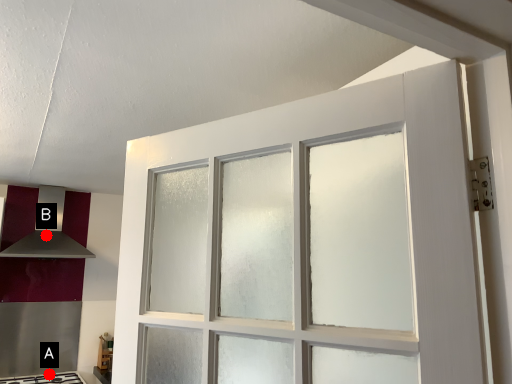
Question: Two points are circled on the image, labeled by A and B beside each circle. Which of the following is the closest to the observer?

Choices:
 (A) A is closer
 (B) B is closer

Answer: (A)